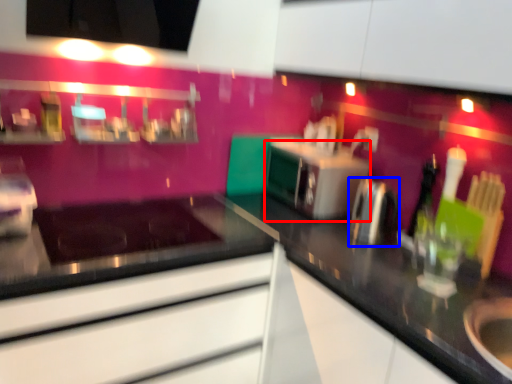
Question: Which object is further to the camera taking this photo, oven (highlighted by a red box) or appliance (highlighted by a blue box)?

Choices:
 (A) oven
 (B) appliance

Answer: (A)